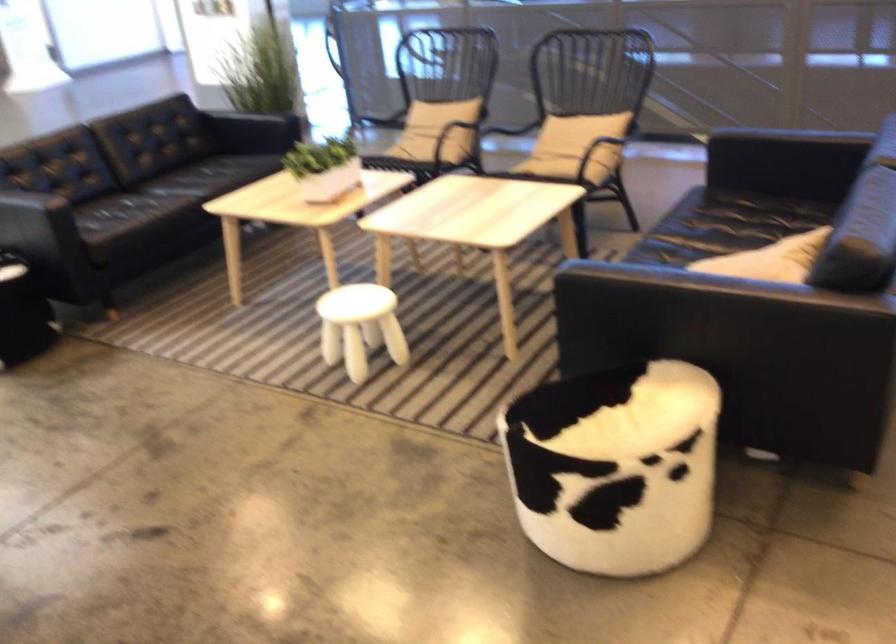
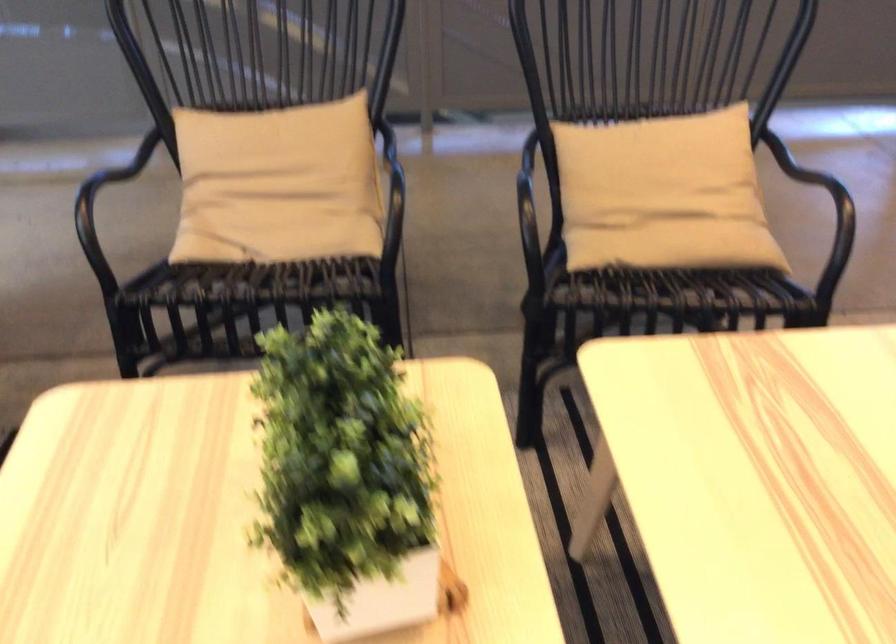
Question: I am providing you with two images of the same scene from different viewpoints. Please identify which objects are invisible in image2.

Choices:
 (A) jar with red lid
 (B) black chair armrest
 (C) beige cushion
 (D) small white stool

Answer: (D)